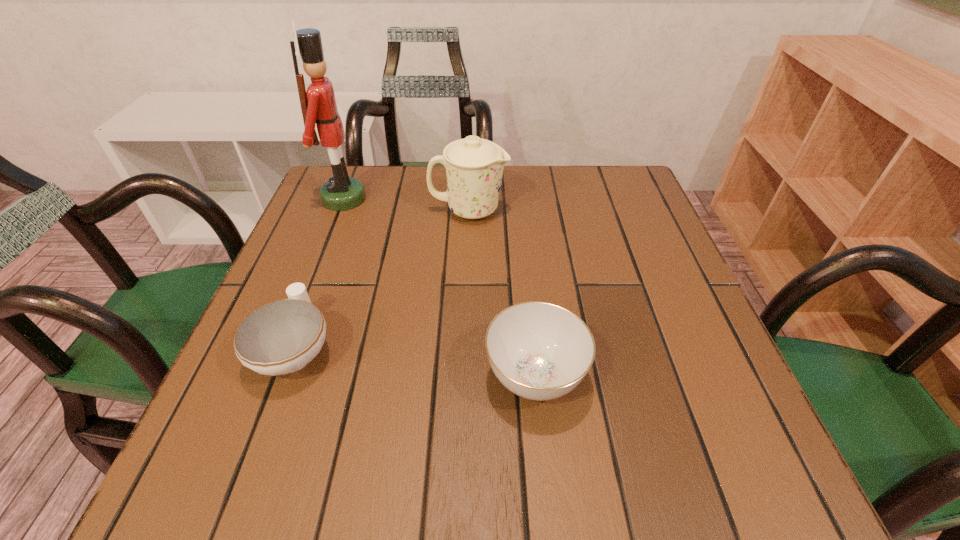
Locate an element on the screen. The image size is (960, 540). free space that is in between the shortest chinaware and the nutcracker is located at coordinates (320, 274).

Where is `free space between the tallest object and the second tallest object`? free space between the tallest object and the second tallest object is located at coordinates (406, 205).

This screenshot has width=960, height=540. What are the coordinates of `object that stands as the closest to the shortest object` in the screenshot? It's located at (540, 351).

Select which object is the closest to the second shortest chinaware. Please provide its 2D coordinates. Your answer should be formatted as a tuple, i.e. [(x, y)], where the tuple contains the x and y coordinates of a point satisfying the conditions above.

[(281, 337)]

You are a GUI agent. You are given a task and a screenshot of the screen. Output one action in this format:
    pyautogui.click(x=<x>, y=<y>)
    Task: Click on the chinaware identified as the second closest to the shortest object
    This screenshot has width=960, height=540.
    Given the screenshot: What is the action you would take?
    pyautogui.click(x=474, y=166)

This screenshot has width=960, height=540. Find the location of `chinaware that stands as the closest to the nutcracker`. chinaware that stands as the closest to the nutcracker is located at coordinates (474, 166).

At what (x,y) coordinates should I click in order to perform the action: click on free point that satisfies the following two spatial constraints: 1. on the front-facing side of the second shortest chinaware; 2. on the right side of the tallest object. Please return your answer as a coordinate pair (x, y). This screenshot has height=540, width=960. Looking at the image, I should click on (275, 376).

This screenshot has width=960, height=540. Find the location of `vacant region that satisfies the following two spatial constraints: 1. on the front-facing side of the tallest object; 2. on the side with the handle of the shortest chinaware`. vacant region that satisfies the following two spatial constraints: 1. on the front-facing side of the tallest object; 2. on the side with the handle of the shortest chinaware is located at coordinates (285, 349).

You are a GUI agent. You are given a task and a screenshot of the screen. Output one action in this format:
    pyautogui.click(x=<x>, y=<y>)
    Task: Click on the vacant space that satisfies the following two spatial constraints: 1. on the side with the handle of the leftmost chinaware; 2. on the front-facing side of the nutcracker
    This screenshot has height=540, width=960.
    Given the screenshot: What is the action you would take?
    pyautogui.click(x=351, y=199)

Identify the location of vacant point that satisfies the following two spatial constraints: 1. on the front-facing side of the tallest object; 2. on the right side of the second tallest chinaware. Image resolution: width=960 pixels, height=540 pixels. (275, 376).